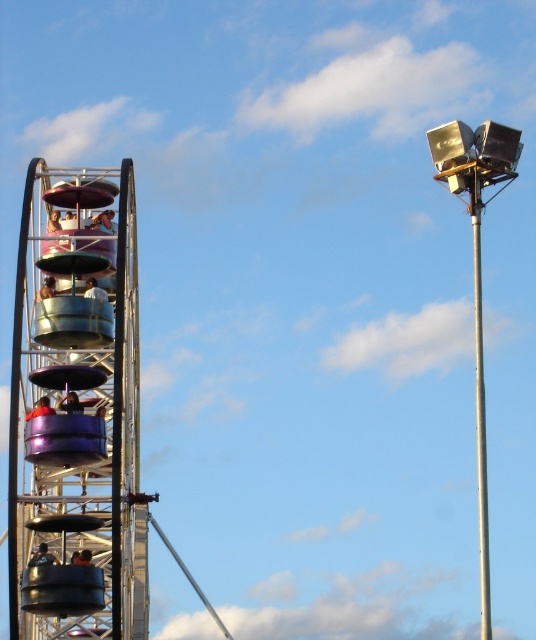
You are a photographer at the fairground. You want to take a photo of the metallic purple ferris wheel car at upper left and the metallic blue helmet at left. Which object should you focus on first if you want to capture both in one shot without moving the camera?

You should focus on the metallic purple ferris wheel car at upper left first because the metallic blue helmet at left is to the right of it, so they are positioned closely together in the frame.

You are standing at the center of the fairground and see the metallic blue helmet at left. Where would you find it relative to your position?

The metallic blue helmet at left is located at the lower left area of the fairground, as its coordinates are at point 0.452 on the x axis and 0.088 on the y axis, which places it towards the bottom left side of the scene.